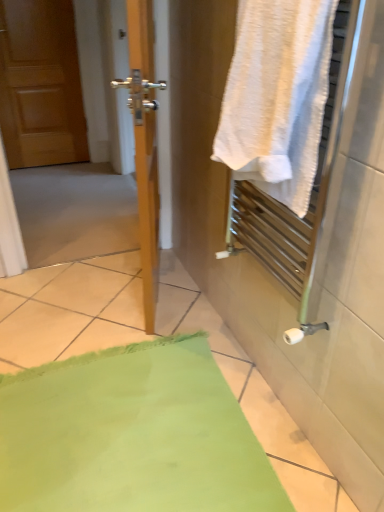
Question: Does point (170, 371) appear closer or farther from the camera than point (319, 73)?

Choices:
 (A) farther
 (B) closer

Answer: (A)

Question: Considering their positions, is green fabric bath mat at lower left located in front of or behind white textured towel at right?

Choices:
 (A) front
 (B) behind

Answer: (B)

Question: Considering the real-world distances, which object is farthest from the wooden screen door at left?

Choices:
 (A) white textured towel at right
 (B) green fabric bath mat at lower left
 (C) matte wood door at left

Answer: (C)

Question: Based on their relative distances, which object is nearer to the green fabric bath mat at lower left?

Choices:
 (A) white textured towel at right
 (B) matte wood door at left
 (C) wooden screen door at left

Answer: (C)